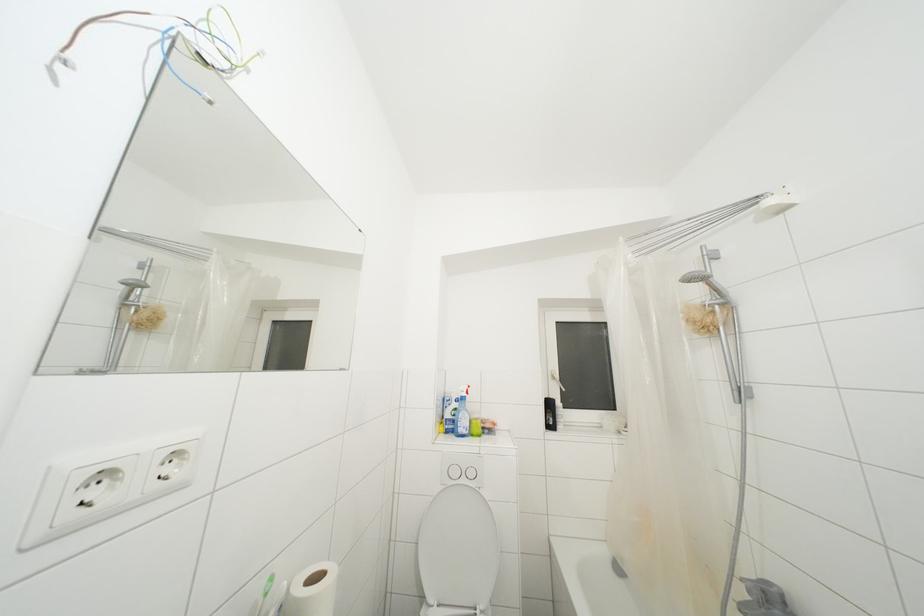
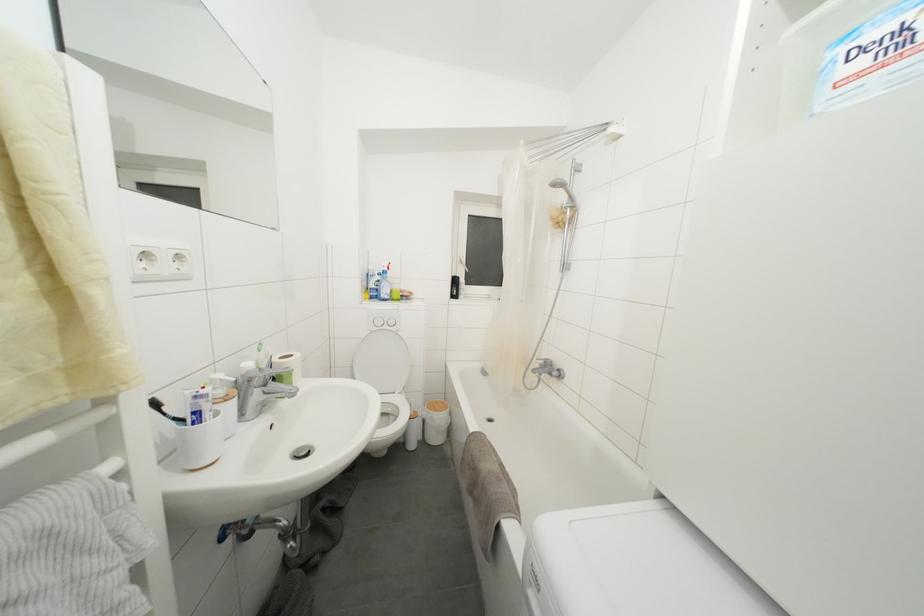
The point at (468, 485) is marked in the first image. Where is the corresponding point in the second image?

(390, 331)